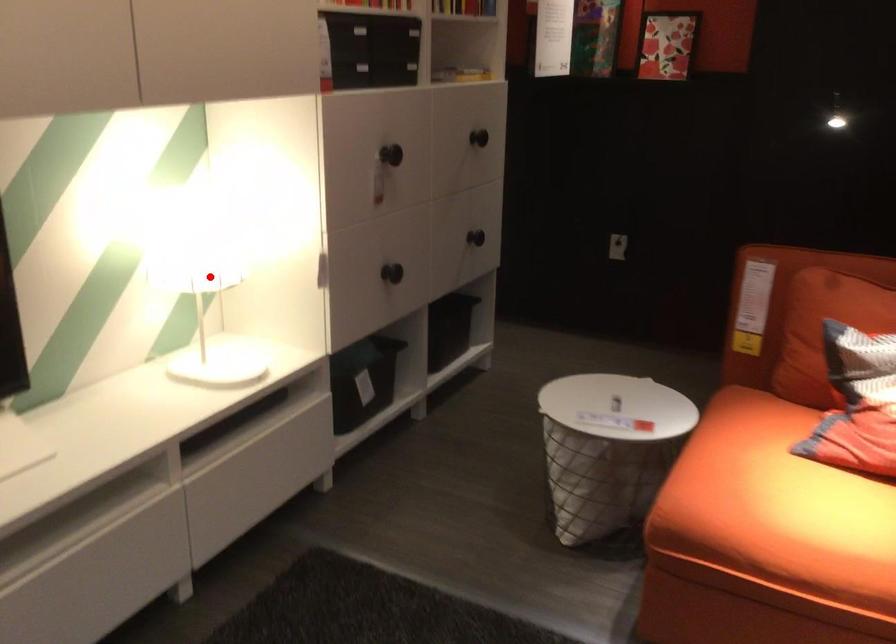
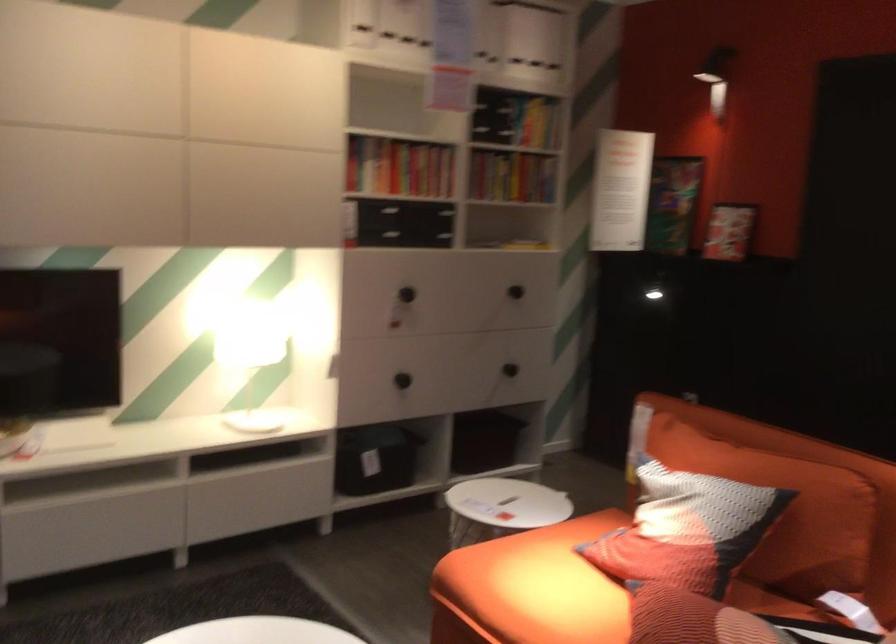
In the second image, find the point that corresponds to the highlighted location in the first image.

(250, 354)